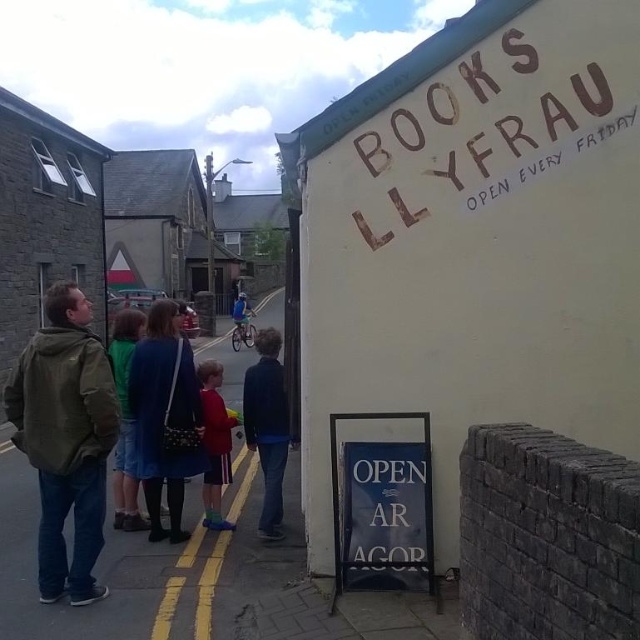
You are a customer entering the bookshop and see the blue denim jeans at center and the blue denim jacket at center. Which item is located lower in the scene?

The blue denim jeans at center is positioned under the blue denim jacket at center, so it is located lower in the scene.

You are a customer entering the bookshop and see both the blue denim jeans at center and the blue fabric jacket at center displayed on a rack. Which item is shorter in height?

The blue denim jeans at center is not as tall as the blue fabric jacket at center, so the blue denim jeans at center is shorter in height.

You are standing in front of the bookshop and see both the blue denim jeans at center and the blue fabric jacket at center. Which one is positioned more to the right side?

The blue denim jeans at center are positioned to the right of the blue fabric jacket at center, so the blue denim jeans at center is more to the right side.